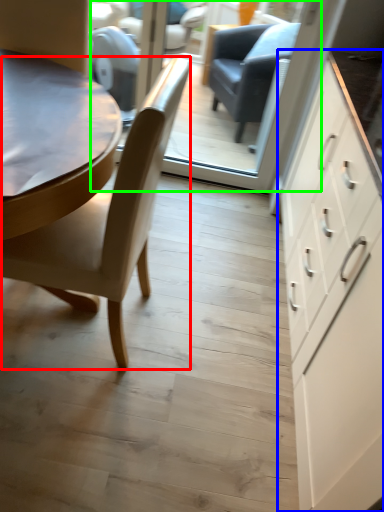
Question: Based on their relative distances, which object is farther from chair (highlighted by a red box)? Choose from cabinetry (highlighted by a blue box) and glass door (highlighted by a green box).

Choices:
 (A) cabinetry
 (B) glass door

Answer: (B)